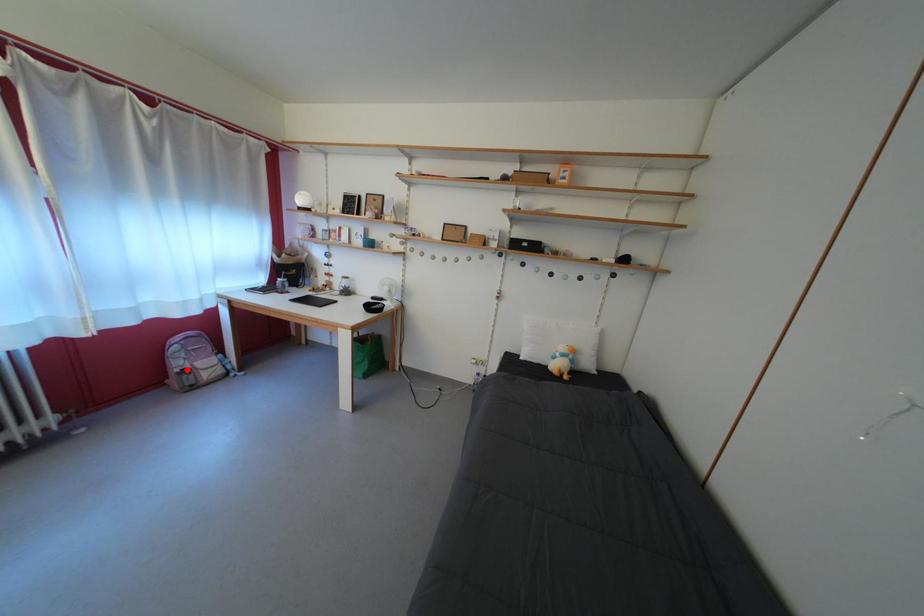
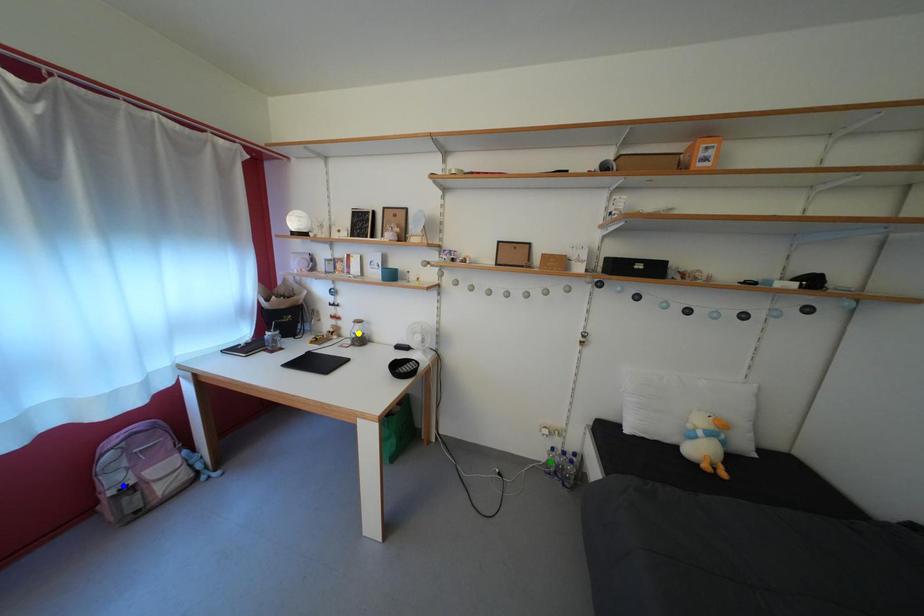
Question: I am providing you with two images of the same scene from different viewpoints. A red point is marked on the first image. You are given multiple points on the second image. Which point in image 2 represents the same 3d spot as the red point in image 1?

Choices:
 (A) green point
 (B) blue point
 (C) yellow point

Answer: (B)